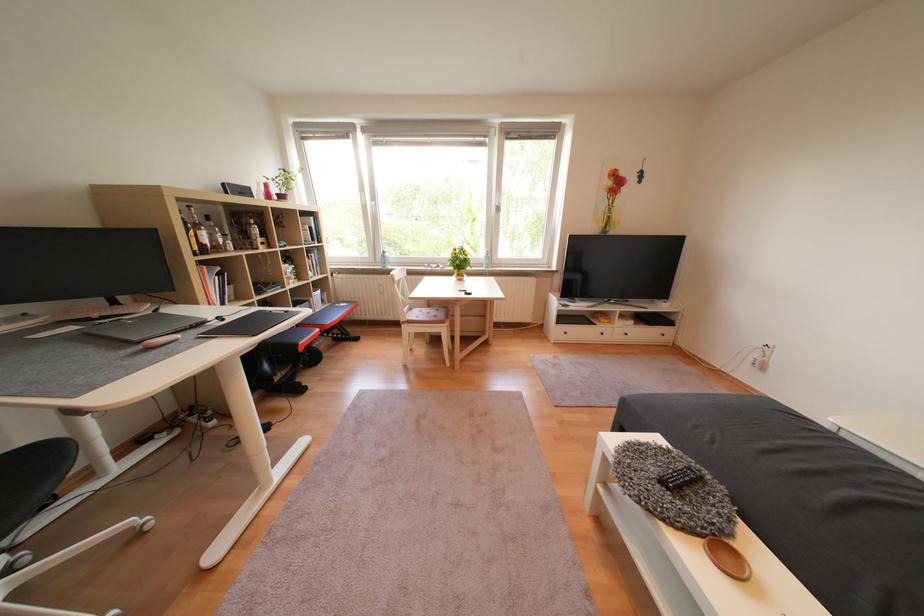
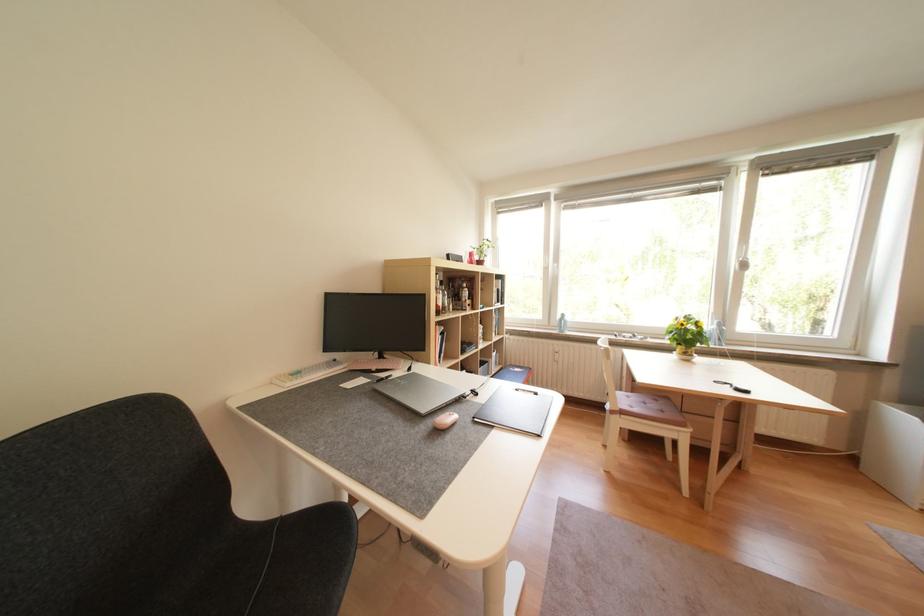
Question: What movement of the cameraman would produce the second image?

Choices:
 (A) Left
 (B) Right
 (C) Forward
 (D) Backward

Answer: (A)